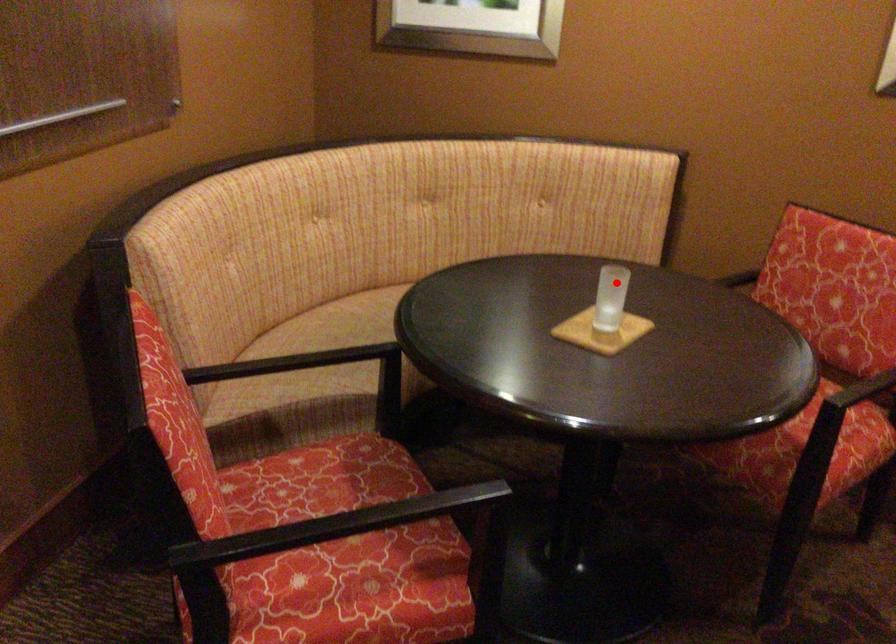
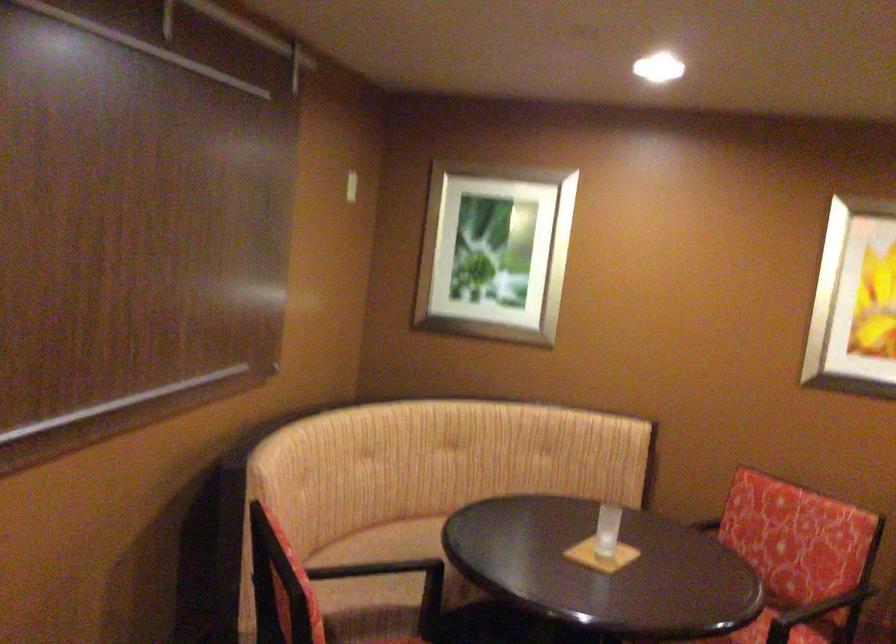
Where in the second image is the point corresponding to the highlighted location from the first image?

(607, 529)